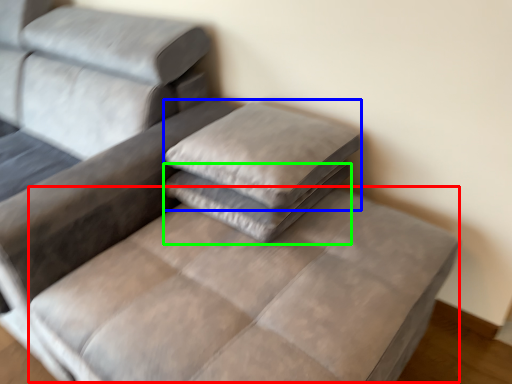
Question: Estimate the real-world distances between objects in this image. Which object is farther from mattress (highlighted by a red box), pillow (highlighted by a blue box) or pillow (highlighted by a green box)?

Choices:
 (A) pillow
 (B) pillow

Answer: (A)